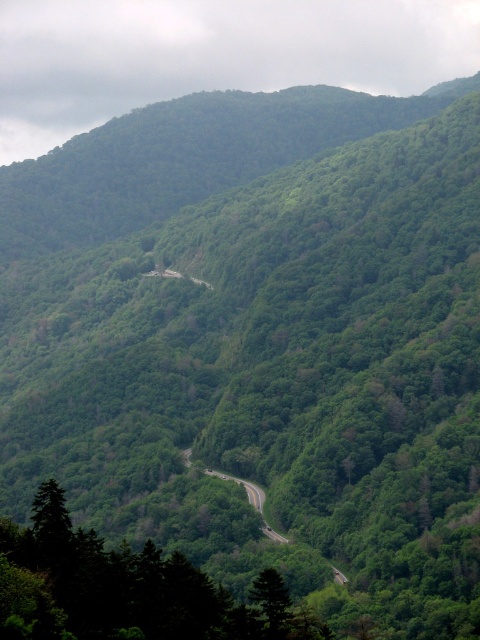
Describe the element at coordinates (129, 588) in the screenshot. I see `green leafy tree at lower left` at that location.

Between green leafy tree at lower left and green asphalt road at center, which one is positioned lower?

green asphalt road at center

Where is `green leafy tree at lower left`? Image resolution: width=480 pixels, height=640 pixels. green leafy tree at lower left is located at coordinates (129, 588).